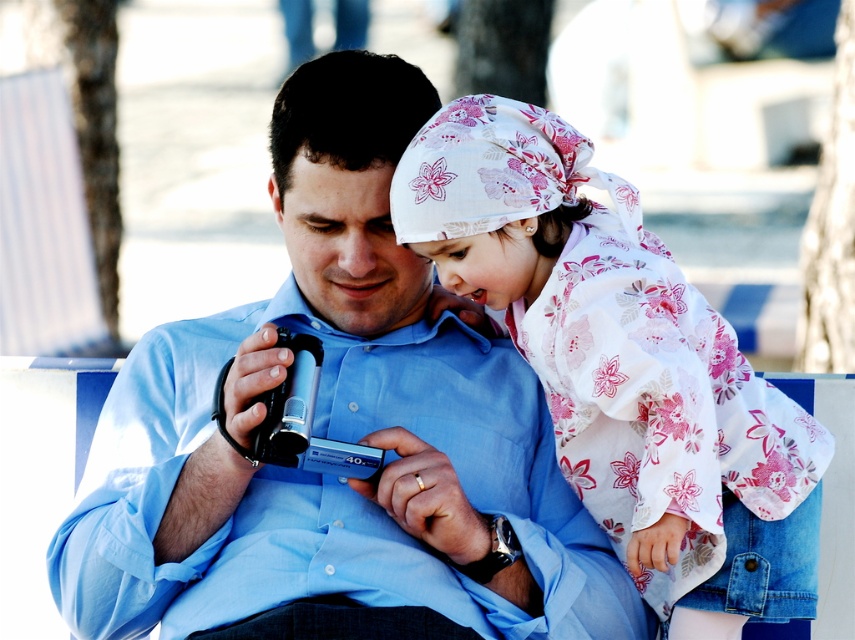
Please provide the 2D coordinates of the blue cotton shirt at center in the image. The answer should be in the format of coordinates enclosed in parentheses, like so, for example, if the coordinates were 0.5,0.5, you would write the answer as follows. Answer the question with the exact coordinates given in the Objects Description. Answer according to the following rules. The answer must be concise and factual, using the exact coordinates provided in the Objects Description. Do not add any extra information.

The blue cotton shirt at center is located at coordinates (337, 435).